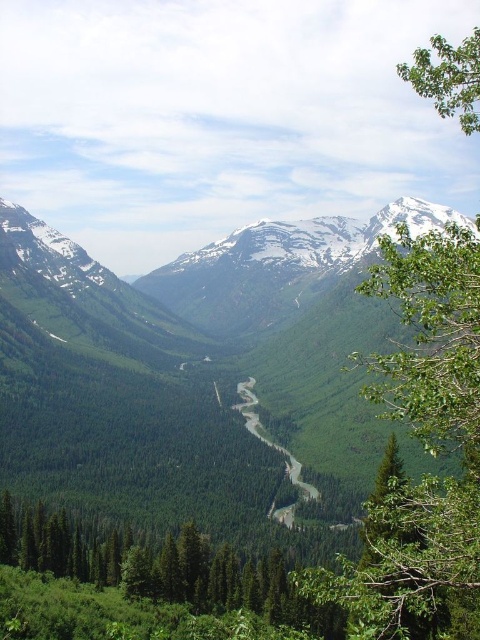
Describe the element at coordinates (424, 449) in the screenshot. This screenshot has width=480, height=640. I see `green leafy tree at right` at that location.

In the scene shown: Can you confirm if green leafy tree at right is positioned below green leafy tree at upper right?

Yes, green leafy tree at right is below green leafy tree at upper right.

What do you see at coordinates (424, 449) in the screenshot? The image size is (480, 640). I see `green leafy tree at right` at bounding box center [424, 449].

Where is `green leafy tree at right`? This screenshot has width=480, height=640. green leafy tree at right is located at coordinates (424, 449).